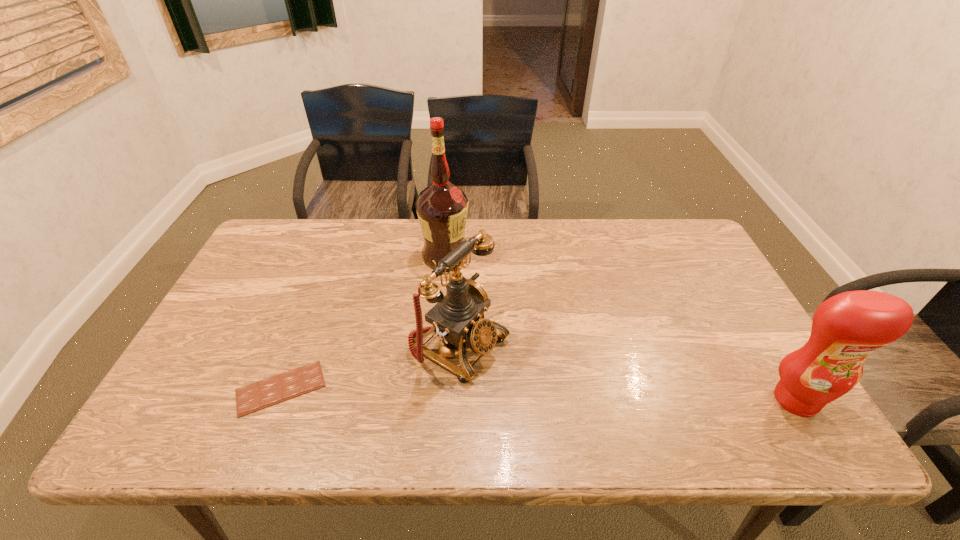
Locate an element on the screen. The image size is (960, 540). vacant area that lies between the condiment and the farthest object is located at coordinates (620, 328).

Find the location of a particular element. This screenshot has height=540, width=960. vacant area between the leftmost object and the rightmost object is located at coordinates (539, 394).

The width and height of the screenshot is (960, 540). In order to click on vacant space that is in between the telephone and the chocolate bar in this screenshot , I will do `click(371, 366)`.

At what (x,y) coordinates should I click in order to perform the action: click on free space between the condiment and the leftmost object. Please return your answer as a coordinate pair (x, y). This screenshot has height=540, width=960. Looking at the image, I should click on (539, 394).

Locate an element on the screen. The image size is (960, 540). blank region between the condiment and the alcohol is located at coordinates (620, 328).

You are a GUI agent. You are given a task and a screenshot of the screen. Output one action in this format:
    pyautogui.click(x=<x>, y=<y>)
    Task: Click on the object identified as the second closest to the rightmost object
    The width and height of the screenshot is (960, 540).
    Given the screenshot: What is the action you would take?
    pyautogui.click(x=442, y=208)

Select which object appears as the third closest to the chocolate bar. Please provide its 2D coordinates. Your answer should be formatted as a tuple, i.e. [(x, y)], where the tuple contains the x and y coordinates of a point satisfying the conditions above.

[(846, 328)]

At what (x,y) coordinates should I click in order to perform the action: click on free space that satisfies the following two spatial constraints: 1. on the back side of the leftmost object; 2. on the left side of the tallest object. Please return your answer as a coordinate pair (x, y). Looking at the image, I should click on 332,256.

Where is `free location that satisfies the following two spatial constraints: 1. on the front side of the farthest object; 2. on the right side of the telephone`? The image size is (960, 540). free location that satisfies the following two spatial constraints: 1. on the front side of the farthest object; 2. on the right side of the telephone is located at coordinates (438, 344).